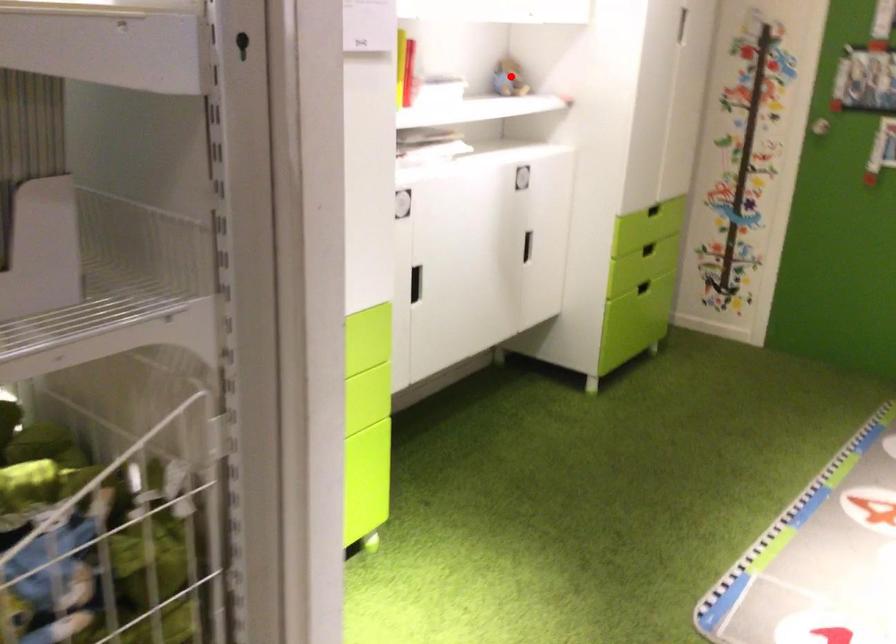
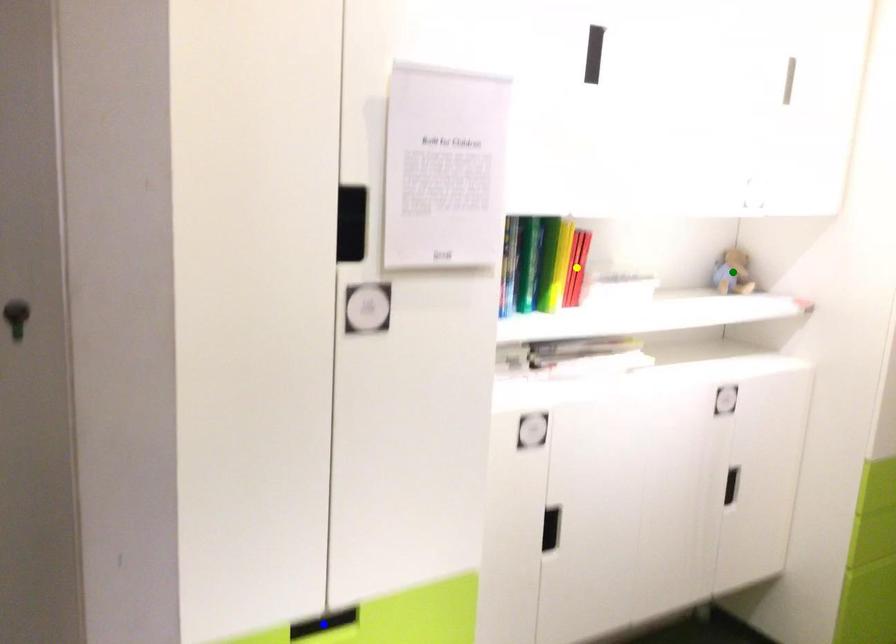
Question: I am providing you with two images of the same scene from different viewpoints. A red point is marked on the first image. You are given multiple points on the second image. Which mark in image 2 goes with the point in image 1?

Choices:
 (A) green point
 (B) yellow point
 (C) blue point

Answer: (A)